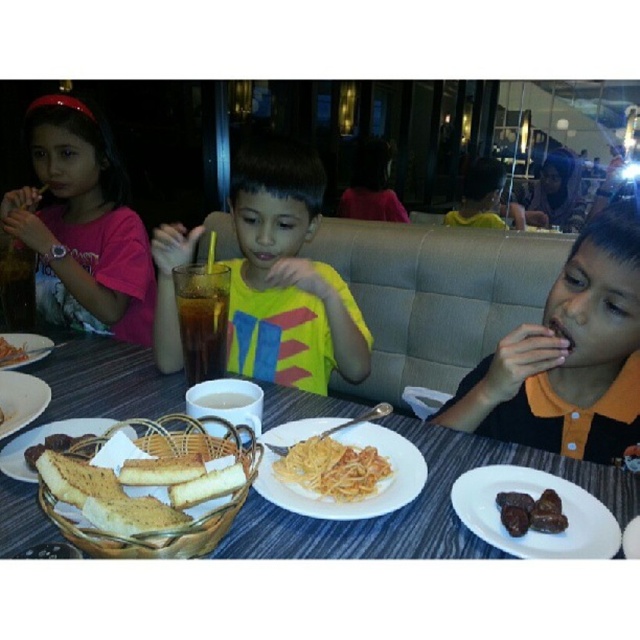
Question: Is orange polo shirt at right bigger than golden brown bread at center?

Choices:
 (A) yes
 (B) no

Answer: (A)

Question: Among these points, which one is farthest from the camera?

Choices:
 (A) (42, 442)
 (B) (70, 221)
 (C) (499, 496)
 (D) (244, 545)

Answer: (B)

Question: Which of these objects is positioned closest to the yellow matte pasta at center?

Choices:
 (A) orange polo shirt at right
 (B) wooden bread basket at center
 (C) brown matte dates at lower right
 (D) brown crumbly bread at lower left

Answer: (C)

Question: Is pink fabric shirt at upper left smaller than brown matte dates at lower right?

Choices:
 (A) no
 (B) yes

Answer: (A)

Question: Considering the relative positions of wooden bread basket at center and brown crumbly bread at lower left in the image provided, where is wooden bread basket at center located with respect to brown crumbly bread at lower left?

Choices:
 (A) below
 (B) above

Answer: (A)

Question: Which object appears farthest from the camera in this image?

Choices:
 (A) brown toasted bread at table left
 (B) brown crumbly bread at lower left
 (C) orange polo shirt at right
 (D) dark brown glossy dates at lower right

Answer: (A)